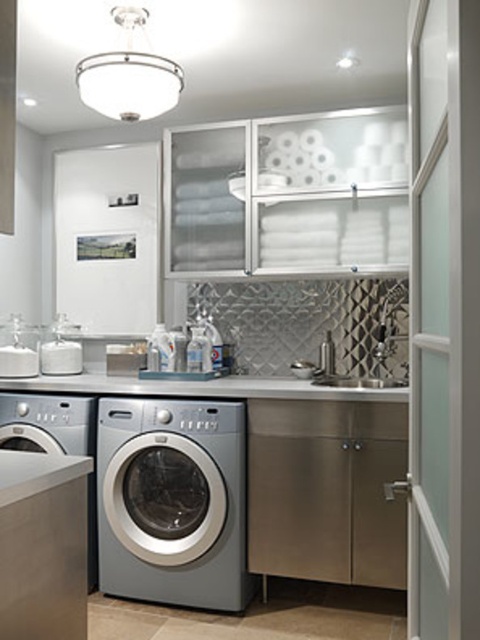
Question: Which is farther from the satin nickel sink at center?

Choices:
 (A) white glossy countertop at center
 (B) satin silver washer at center

Answer: (B)

Question: In this image, where is white glossy countertop at center located relative to satin nickel sink at center?

Choices:
 (A) above
 (B) below

Answer: (B)

Question: Among these objects, which one is farthest from the camera?

Choices:
 (A) satin nickel sink at center
 (B) satin silver washing machine at lower left

Answer: (A)

Question: Can you confirm if satin silver washing machine at lower left is positioned above satin nickel sink at center?

Choices:
 (A) no
 (B) yes

Answer: (A)

Question: Can you confirm if satin silver washer at center is smaller than satin nickel sink at center?

Choices:
 (A) yes
 (B) no

Answer: (B)

Question: Which of the following is the closest to the observer?

Choices:
 (A) (193, 580)
 (B) (84, 397)
 (C) (264, 388)
 (D) (381, 356)

Answer: (C)